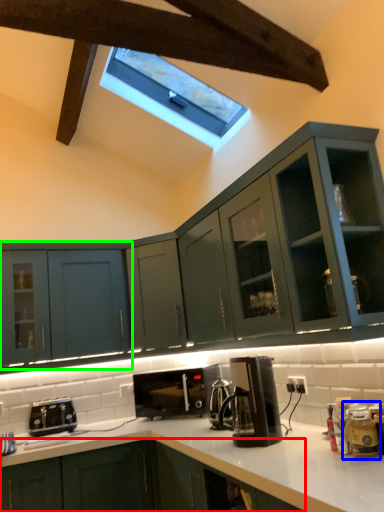
Question: Which is farther away from cabinetry (highlighted by a red box)? appliance (highlighted by a blue box) or cabinetry (highlighted by a green box)?

Choices:
 (A) appliance
 (B) cabinetry

Answer: (A)